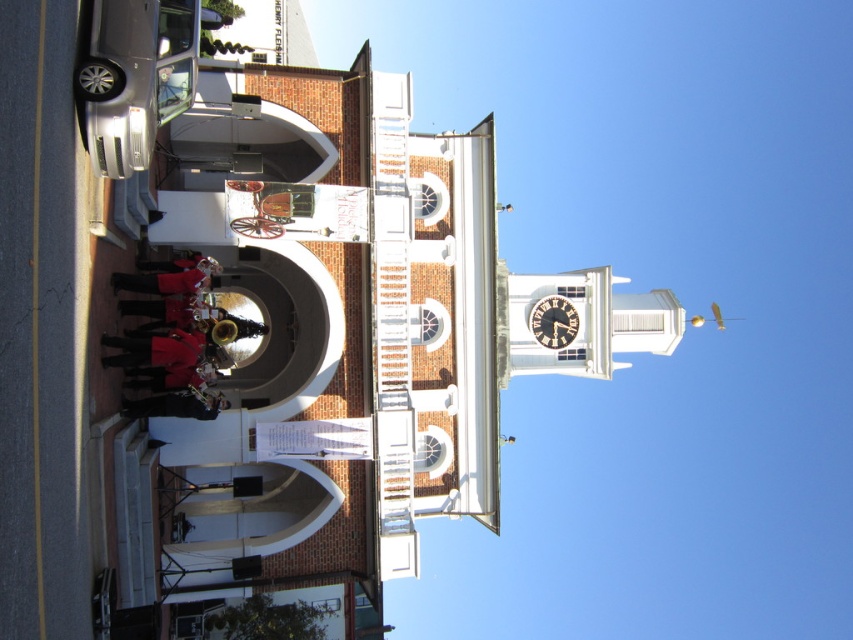
Question: Is satin silver sedan at left further to the viewer compared to wooden clock at upper center?

Choices:
 (A) no
 (B) yes

Answer: (A)

Question: Can you confirm if satin silver sedan at left is wider than wooden clock at upper center?

Choices:
 (A) no
 (B) yes

Answer: (B)

Question: Which point is farther from the camera taking this photo?

Choices:
 (A) (196, 35)
 (B) (563, 330)

Answer: (B)

Question: Is satin silver sedan at left positioned in front of wooden clock at upper center?

Choices:
 (A) yes
 (B) no

Answer: (A)